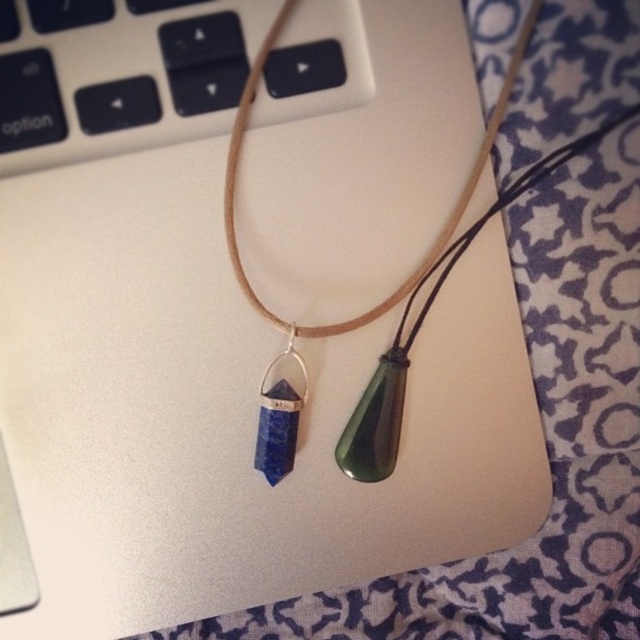
You are organizing a jewelry display and need to place the green polished stone pendant at center and the lapis lazuli stone at center into separate compartments. If the compartments are designed to accommodate the size of each pendant, which compartment should be larger?

The compartment for the green polished stone pendant at center should be larger because it is bigger than the lapis lazuli stone at center.

You are organizing a jewelry display and need to arrange the green polished stone pendant at center and the lapis lazuli stone at center from left to right. Which pendant should be placed first on the left side?

The lapis lazuli stone at center should be placed first on the left side because the green polished stone pendant at center is positioned to its right.